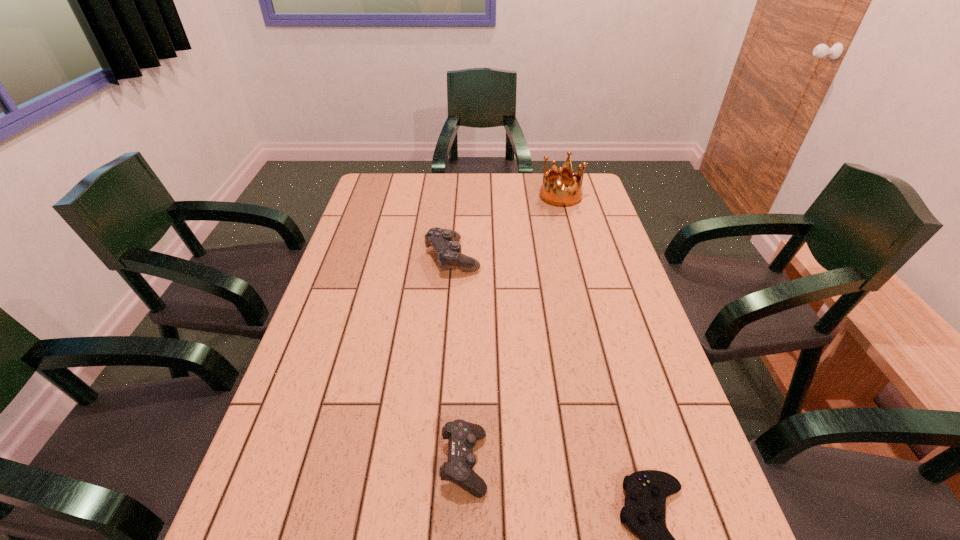
I want to click on crown, so click(x=552, y=191).

Where is `the tallest object`? Image resolution: width=960 pixels, height=540 pixels. the tallest object is located at coordinates (552, 191).

I want to click on the third shortest object, so click(x=444, y=242).

Locate an element on the screen. This screenshot has width=960, height=540. the tallest control is located at coordinates (444, 242).

This screenshot has width=960, height=540. In order to click on the second tallest control in this screenshot , I will do `click(462, 435)`.

This screenshot has height=540, width=960. I want to click on vacant area situated on the front of the tallest object, so click(575, 251).

Where is `free spot located on the right of the tallest control`? The height and width of the screenshot is (540, 960). free spot located on the right of the tallest control is located at coordinates (506, 258).

Where is `vacant space located 0.080m on the back of the second shortest control`? This screenshot has height=540, width=960. vacant space located 0.080m on the back of the second shortest control is located at coordinates (466, 398).

You are a GUI agent. You are given a task and a screenshot of the screen. Output one action in this format:
    pyautogui.click(x=<x>, y=<y>)
    Task: Click on the object located at the far edge
    Image resolution: width=960 pixels, height=540 pixels.
    Given the screenshot: What is the action you would take?
    pyautogui.click(x=552, y=191)

This screenshot has height=540, width=960. What are the coordinates of `object that is positioned at the right edge` in the screenshot? It's located at (552, 191).